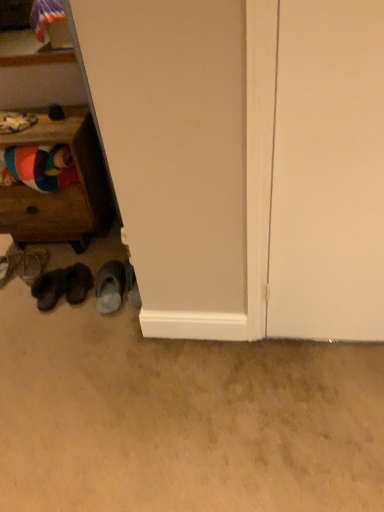
Question: Considering the relative sizes of white matte door at right and gray fuzzy slippers at lower left, the 5th footwear when ordered from left to right, in the image provided, is white matte door at right wider than gray fuzzy slippers at lower left, the 5th footwear when ordered from left to right,?

Choices:
 (A) yes
 (B) no

Answer: (B)

Question: From a real-world perspective, is white matte door at right located beneath gray fuzzy slippers at lower left, the 1th footwear when ordered from right to left?

Choices:
 (A) no
 (B) yes

Answer: (A)

Question: Is white matte door at right at the left side of gray fuzzy slippers at lower left, the 1th footwear when ordered from right to left?

Choices:
 (A) no
 (B) yes

Answer: (A)

Question: Can you confirm if white matte door at right is thinner than gray fuzzy slippers at lower left, the 1th footwear when ordered from right to left?

Choices:
 (A) yes
 (B) no

Answer: (A)

Question: Is white matte door at right closer to camera compared to gray fuzzy slippers at lower left, the 1th footwear when ordered from right to left?

Choices:
 (A) no
 (B) yes

Answer: (B)

Question: Considering the relative sizes of white matte door at right and gray fuzzy slippers at lower left, the 1th footwear when ordered from right to left, in the image provided, is white matte door at right bigger than gray fuzzy slippers at lower left, the 1th footwear when ordered from right to left,?

Choices:
 (A) yes
 (B) no

Answer: (A)

Question: Is the surface of wooden drawer at left in direct contact with multicolored fabric at left?

Choices:
 (A) no
 (B) yes

Answer: (A)

Question: Is wooden drawer at left facing away from multicolored fabric at left?

Choices:
 (A) yes
 (B) no

Answer: (B)

Question: Is wooden drawer at left shorter than multicolored fabric at left?

Choices:
 (A) no
 (B) yes

Answer: (A)

Question: Considering the relative sizes of wooden drawer at left and multicolored fabric at left in the image provided, is wooden drawer at left thinner than multicolored fabric at left?

Choices:
 (A) yes
 (B) no

Answer: (B)

Question: Is wooden drawer at left far from multicolored fabric at left?

Choices:
 (A) no
 (B) yes

Answer: (A)

Question: From the image's perspective, is wooden drawer at left on multicolored fabric at left?

Choices:
 (A) no
 (B) yes

Answer: (A)

Question: Is leather sandal at lower left, which is the fifth footwear from right to left, facing away from multicolored fabric at left?

Choices:
 (A) no
 (B) yes

Answer: (A)